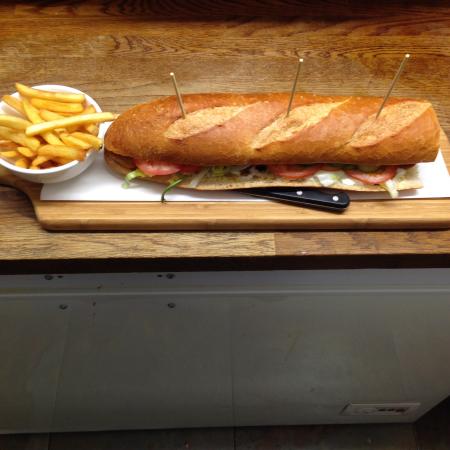
I want to click on 1 black and silver handle, so [x=322, y=202].